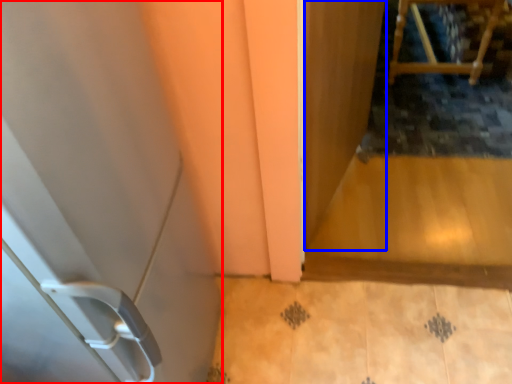
Question: Which object appears farthest to the camera in this image, door (highlighted by a red box) or screen door (highlighted by a blue box)?

Choices:
 (A) door
 (B) screen door

Answer: (B)